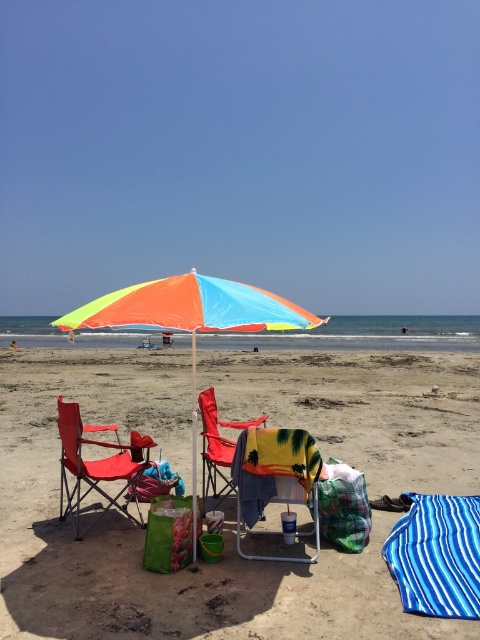
Between point (157, 316) and point (433, 557), which one is positioned in front?

Point (157, 316)

Between rainbow fabric umbrella at center and blue striped towel at lower right, which one has less height?

With less height is blue striped towel at lower right.

Identify the location of rainbow fabric umbrella at center. (192, 314).

Which is in front, point (108, 616) or point (404, 536)?

Point (108, 616) is in front.

You are a GUI agent. You are given a task and a screenshot of the screen. Output one action in this format:
    pyautogui.click(x=<x>, y=<y>)
    Task: Click on the beige sand at center
    The image size is (480, 640).
    Given the screenshot: What is the action you would take?
    pyautogui.click(x=143, y=531)

At what (x,y) coordinates should I click in order to perform the action: click on beige sand at center. Please return your answer as a coordinate pair (x, y). Image resolution: width=480 pixels, height=640 pixels. Looking at the image, I should click on (143, 531).

Which is below, blue striped towel at lower right or matte red beach chair at center-left?

blue striped towel at lower right is lower down.

The image size is (480, 640). Describe the element at coordinates (436, 556) in the screenshot. I see `blue striped towel at lower right` at that location.

Where is `blue striped towel at lower right`? blue striped towel at lower right is located at coordinates pyautogui.click(x=436, y=556).